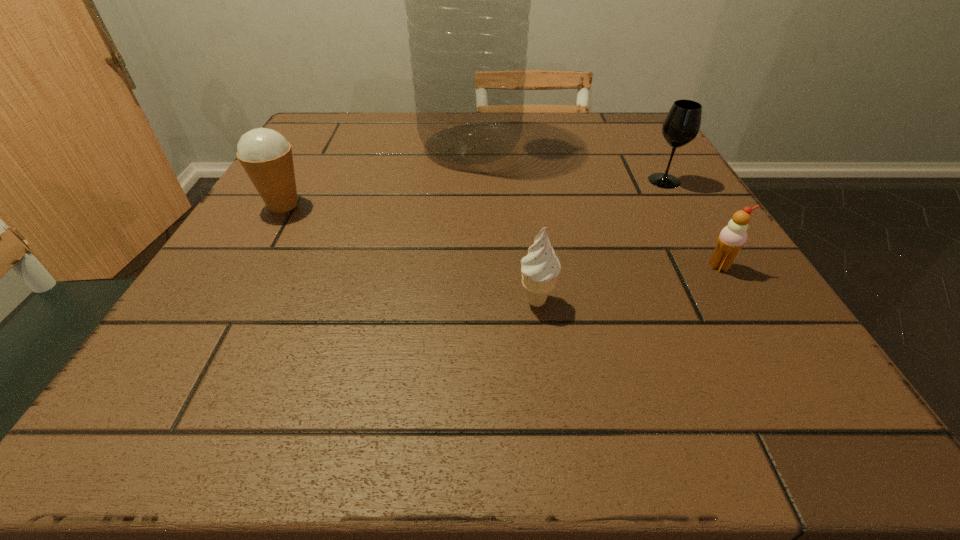
Identify the location of the farthest object. (467, 0).

I want to click on the tallest object, so click(x=467, y=0).

What are the coordinates of `the fourth nearest object` in the screenshot? It's located at (681, 125).

This screenshot has width=960, height=540. Find the location of `the farthest icecream`. the farthest icecream is located at coordinates (266, 156).

This screenshot has height=540, width=960. Identify the location of the third nearest object. (266, 156).

Locate an element on the screen. the nearest object is located at coordinates (540, 268).

You are a GUI agent. You are given a task and a screenshot of the screen. Output one action in this format:
    pyautogui.click(x=<x>, y=<y>)
    Task: Click on the second icecream from right to left
    
    Given the screenshot: What is the action you would take?
    pyautogui.click(x=540, y=268)

Find the location of a particular element. the shortest icecream is located at coordinates (732, 238).

Where is `the shortest object`? the shortest object is located at coordinates (732, 238).

At what (x,y) coordinates should I click in order to perform the action: click on vacant space located on the front of the farthest object. Please return your answer as a coordinate pair (x, y). This screenshot has height=540, width=960. Looking at the image, I should click on (466, 280).